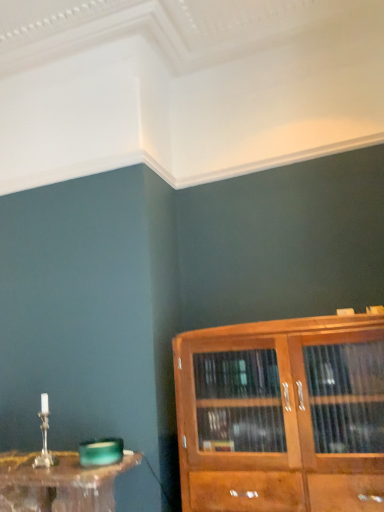
Question: Does translucent glass table at lower left have a lesser width compared to wooden cabinet at right?

Choices:
 (A) yes
 (B) no

Answer: (A)

Question: Does translucent glass table at lower left have a larger size compared to wooden cabinet at right?

Choices:
 (A) no
 (B) yes

Answer: (A)

Question: Does translucent glass table at lower left appear on the left side of wooden cabinet at right?

Choices:
 (A) yes
 (B) no

Answer: (A)

Question: From the image's perspective, is translucent glass table at lower left located above wooden cabinet at right?

Choices:
 (A) yes
 (B) no

Answer: (B)

Question: Is translucent glass table at lower left shorter than wooden cabinet at right?

Choices:
 (A) no
 (B) yes

Answer: (B)

Question: Is translucent glass table at lower left facing towards wooden cabinet at right?

Choices:
 (A) no
 (B) yes

Answer: (A)

Question: Is wooden cabinet at right bigger than translucent glass table at lower left?

Choices:
 (A) yes
 (B) no

Answer: (A)

Question: Is wooden cabinet at right positioned with its back to translucent glass table at lower left?

Choices:
 (A) no
 (B) yes

Answer: (A)

Question: From a real-world perspective, is wooden cabinet at right below translucent glass table at lower left?

Choices:
 (A) no
 (B) yes

Answer: (A)

Question: Can we say wooden cabinet at right lies outside translucent glass table at lower left?

Choices:
 (A) yes
 (B) no

Answer: (A)

Question: Can you confirm if wooden cabinet at right is positioned to the left of translucent glass table at lower left?

Choices:
 (A) yes
 (B) no

Answer: (B)

Question: Does wooden cabinet at right have a lesser height compared to translucent glass table at lower left?

Choices:
 (A) no
 (B) yes

Answer: (A)

Question: From their relative heights in the image, would you say wooden cabinet at right is taller or shorter than translucent glass table at lower left?

Choices:
 (A) short
 (B) tall

Answer: (B)